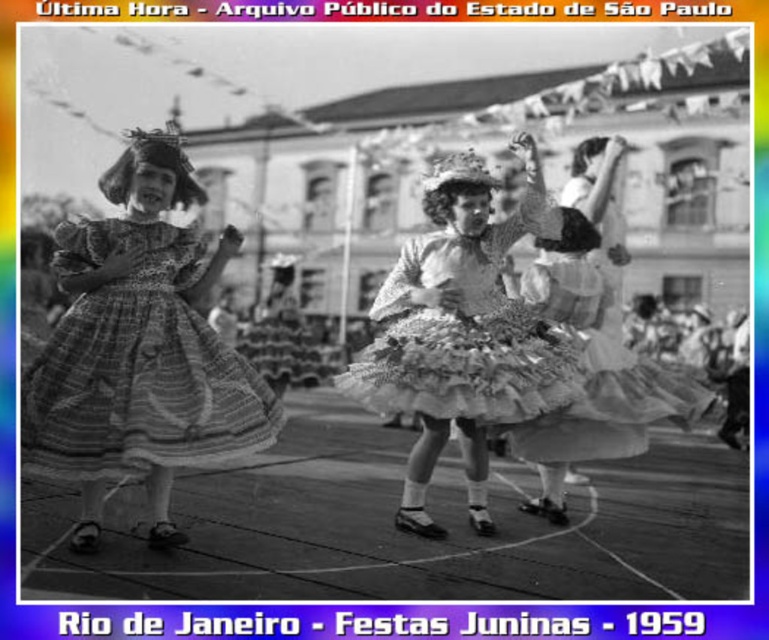
You are a photographer analyzing the positions of the girls in the Festas Juninas photograph. The girls are wearing a textured cotton dress at left and another outfit. Based on their positions, which girl is closer to the left edge of the photo?

The textured cotton dress at left is located at point (137, 364), so the girl wearing the textured cotton dress at left is closer to the left edge of the photo.

You are a photographer trying to capture the Festas Juninas scene. You notice two points in the image at coordinates point (498, 234) and point (598, 356). Which point is closer to your camera lens?

Point (498, 234) is further to the camera than point (598, 356). Therefore, point (498, 234) is closer to the camera lens.

You are a photographer trying to capture a photo of the two girls in the Festas Juninas scene. You notice that the textured cotton dress at left and the ruffled fabric dress at center are positioned in a way that one is taller than the other. Which girl should you focus on if you want to ensure the subject is taller in your frame?

The textured cotton dress at left is much taller than the ruffled fabric dress at center, so focusing on the girl wearing the textured cotton dress at left will ensure the subject is taller in the frame.